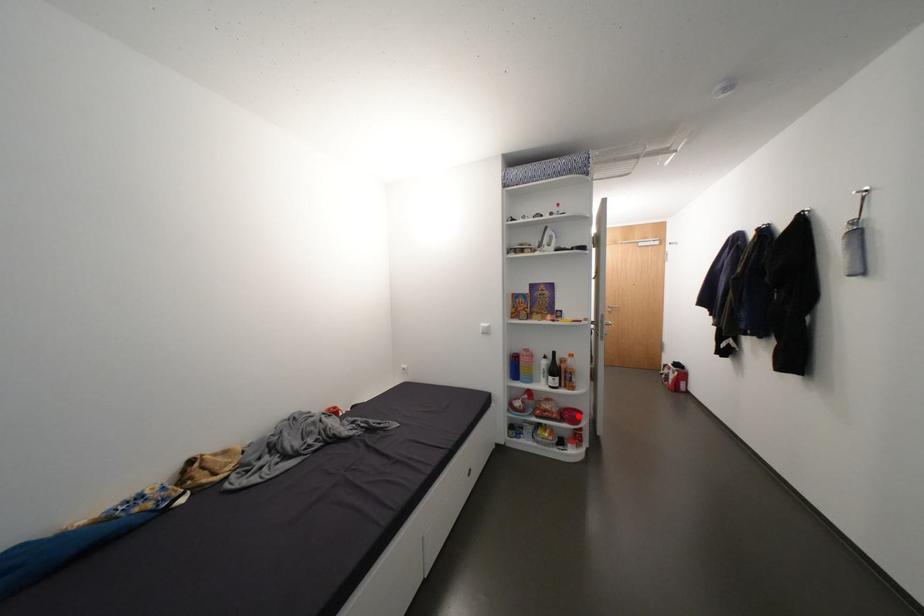
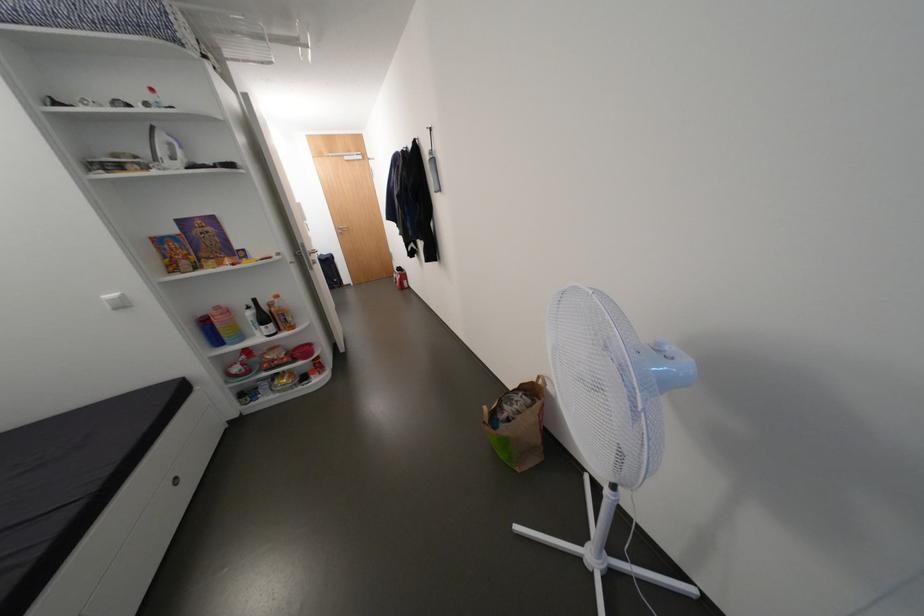
Where in the second image is the point corresponding to the highlighted location from the first image?

(310, 352)